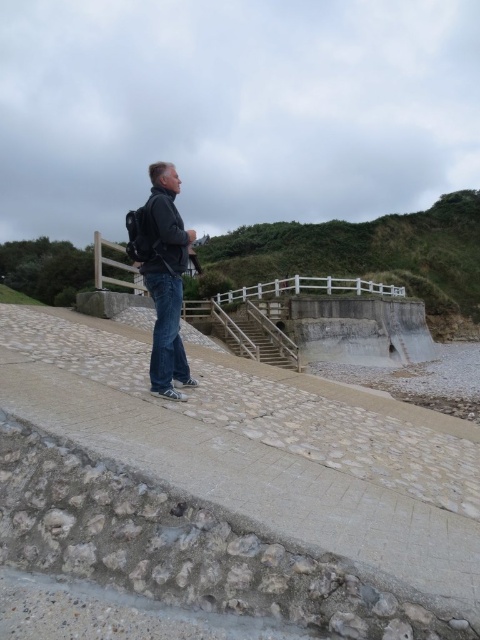
Question: Which of the following is the closest to the observer?

Choices:
 (A) pyautogui.click(x=94, y=365)
 (B) pyautogui.click(x=173, y=348)

Answer: (B)

Question: Is smooth concrete at center positioned before matte black backpack at center?

Choices:
 (A) yes
 (B) no

Answer: (A)

Question: Is smooth concrete at center thinner than denim at center?

Choices:
 (A) no
 (B) yes

Answer: (A)

Question: Among these objects, which one is farthest from the camera?

Choices:
 (A) smooth concrete at center
 (B) matte black backpack at center
 (C) smooth concrete stairs at center
 (D) denim at center

Answer: (C)

Question: Does denim at center lie behind smooth concrete stairs at center?

Choices:
 (A) no
 (B) yes

Answer: (A)

Question: Based on their relative distances, which object is farther from the smooth concrete at center?

Choices:
 (A) matte black backpack at center
 (B) smooth concrete stairs at center
 (C) denim at center

Answer: (B)